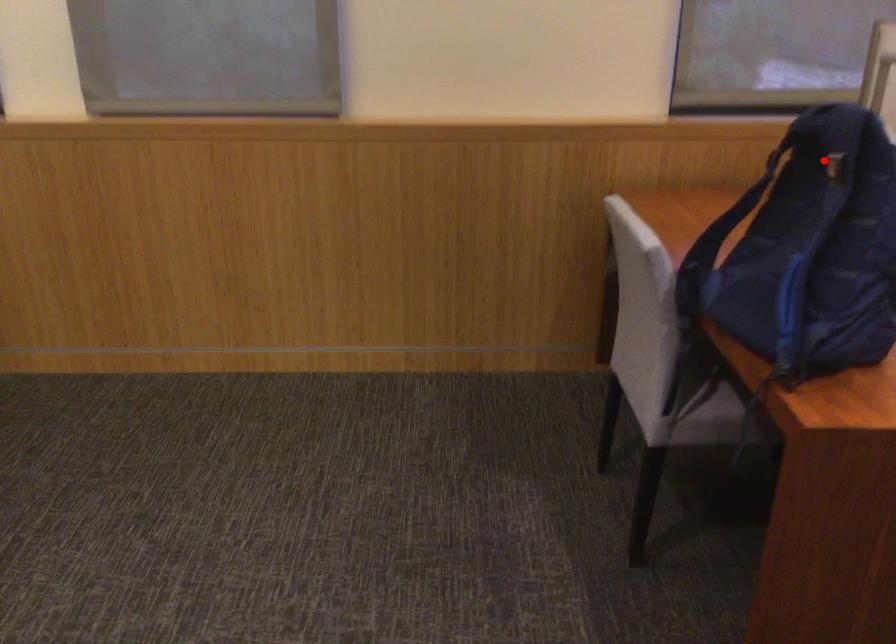
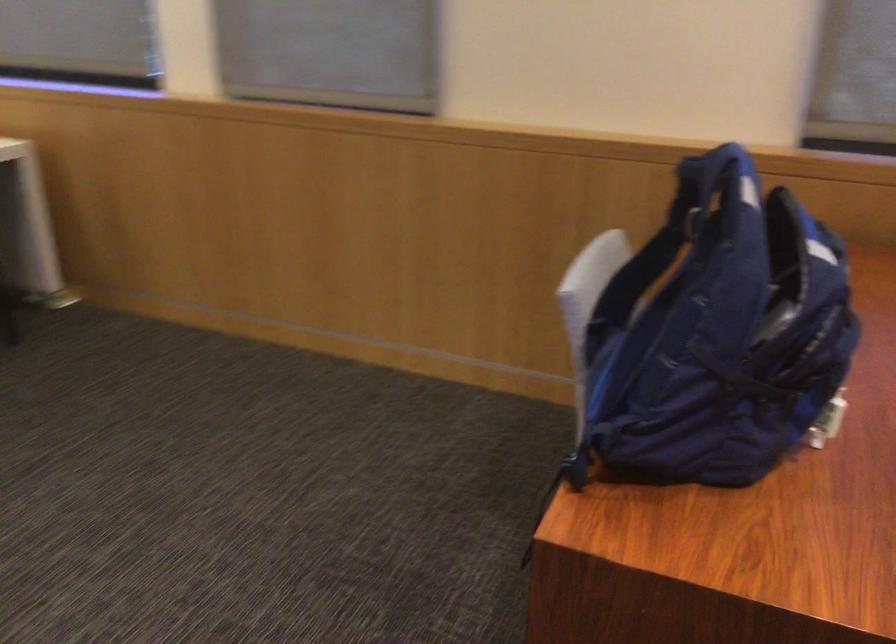
Where in the second image is the point corresponding to the highlighted location from the first image?

(687, 216)